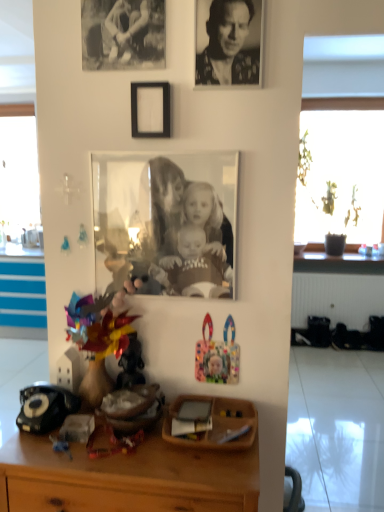
Where is `blank space situated above wooden desk at center (from a real-world perspective)`? Image resolution: width=384 pixels, height=512 pixels. blank space situated above wooden desk at center (from a real-world perspective) is located at coordinates (148, 446).